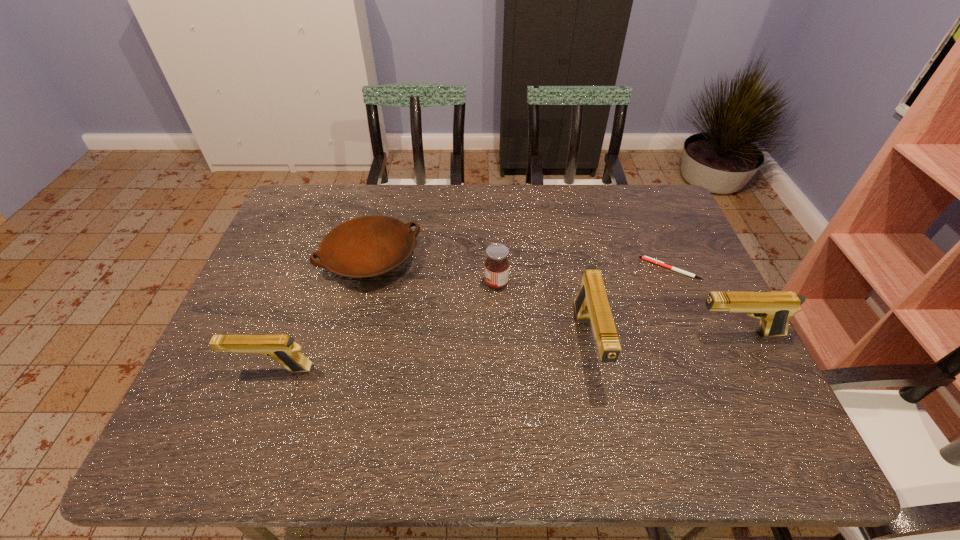
Where is `free spot between the leftmost pistol and the jam`? The width and height of the screenshot is (960, 540). free spot between the leftmost pistol and the jam is located at coordinates (384, 326).

Where is `free space between the third object from right to left and the jam`? This screenshot has height=540, width=960. free space between the third object from right to left and the jam is located at coordinates (542, 314).

Locate an element on the screen. The height and width of the screenshot is (540, 960). vacant region between the fifth tallest object and the jam is located at coordinates (433, 271).

Identify the location of vacant space that is in between the second pistol from right to left and the rightmost pistol. Image resolution: width=960 pixels, height=540 pixels. (662, 339).

Find the location of a particular element. Image resolution: width=960 pixels, height=540 pixels. vacant region between the jam and the rightmost pistol is located at coordinates (616, 308).

Locate an element on the screen. free space between the fifth tallest object and the pen is located at coordinates pos(520,264).

Locate which object is the third closest to the second tallest pistol. Please provide its 2D coordinates. Your answer should be formatted as a tuple, i.e. [(x, y)], where the tuple contains the x and y coordinates of a point satisfying the conditions above.

[(496, 270)]

This screenshot has width=960, height=540. In order to click on the second closest object relative to the rightmost pistol in this screenshot , I will do `click(591, 304)`.

Identify the location of pistol object that ranks as the third closest to the second shortest object. (774, 309).

Find the location of a particular element. pistol that is the closest to the leftmost pistol is located at coordinates (591, 304).